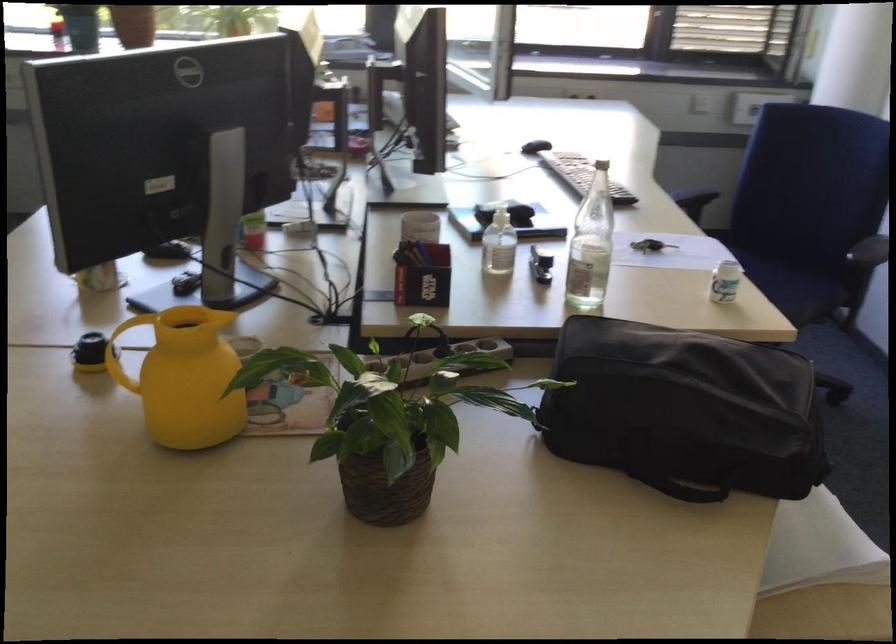
Where would you lift the black lens cap? Please return your answer as a coordinate pair (x, y).

(90, 352)